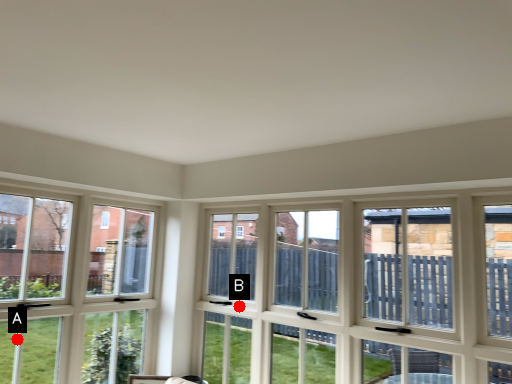
Question: Two points are circled on the image, labeled by A and B beside each circle. Which point appears closest to the camera in this image?

Choices:
 (A) A is closer
 (B) B is closer

Answer: (A)